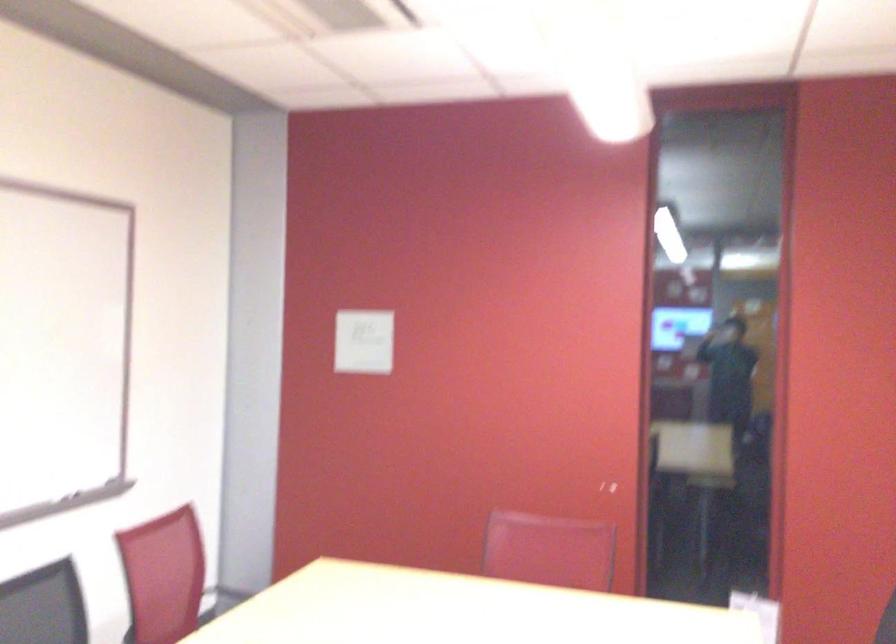
The images are taken continuously from a first-person perspective. In which direction is your viewpoint rotating?

The camera rotated toward right-down.